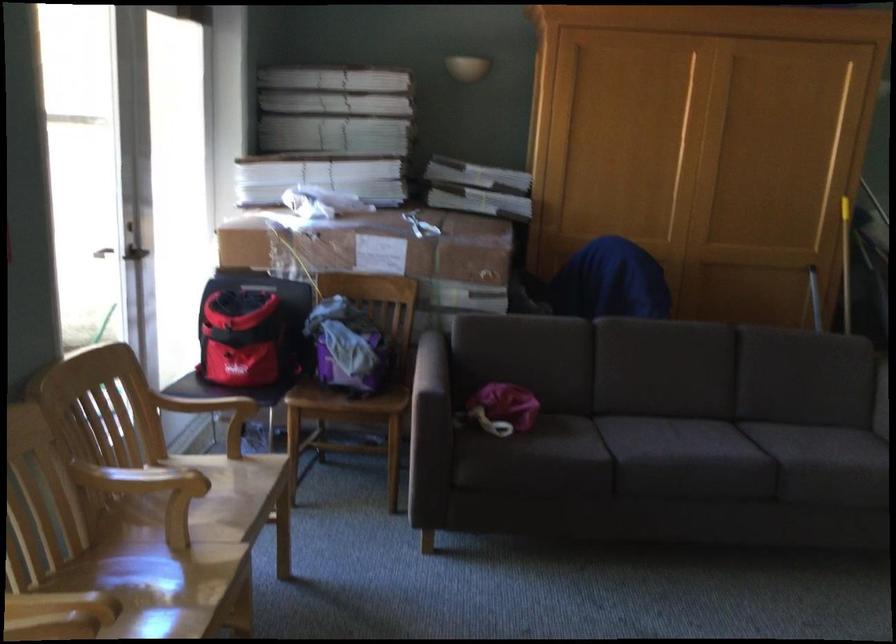
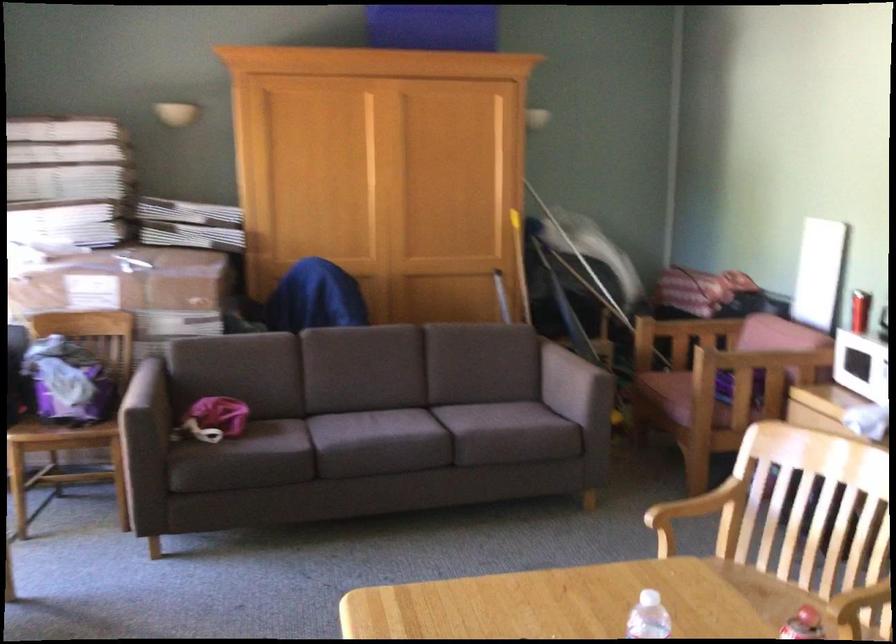
The images are taken continuously from a first-person perspective. In which direction are you moving?

The cameraman moved toward right, backward.